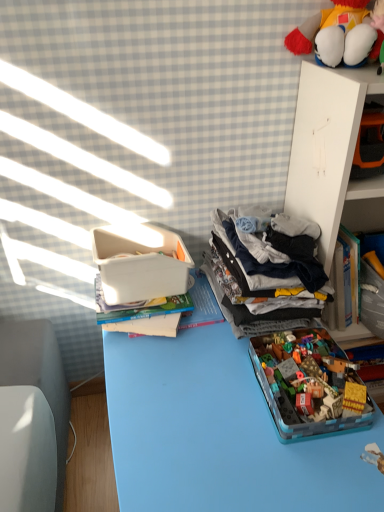
Question: Is dark gray cotton clothes at center right at the back of white plastic container at upper left?

Choices:
 (A) yes
 (B) no

Answer: (B)

Question: Is white plastic container at upper left at the right side of dark gray cotton clothes at center right?

Choices:
 (A) yes
 (B) no

Answer: (B)

Question: Considering the relative sizes of white plastic container at upper left and dark gray cotton clothes at center right in the image provided, is white plastic container at upper left wider than dark gray cotton clothes at center right?

Choices:
 (A) no
 (B) yes

Answer: (B)

Question: Can you confirm if white plastic container at upper left is thinner than dark gray cotton clothes at center right?

Choices:
 (A) yes
 (B) no

Answer: (B)

Question: Considering the relative positions of white plastic container at upper left and dark gray cotton clothes at center right in the image provided, is white plastic container at upper left to the left of dark gray cotton clothes at center right from the viewer's perspective?

Choices:
 (A) no
 (B) yes

Answer: (B)

Question: In the image, is dark gray cotton clothes at center right positioned in front of or behind white cardboard at upper right?

Choices:
 (A) front
 (B) behind

Answer: (B)

Question: Which is correct: dark gray cotton clothes at center right is inside white cardboard at upper right, or outside of it?

Choices:
 (A) inside
 (B) outside

Answer: (B)

Question: From the image's perspective, relative to white cardboard at upper right, is dark gray cotton clothes at center right above or below?

Choices:
 (A) below
 (B) above

Answer: (B)

Question: Is point (301, 313) closer or farther from the camera than point (306, 80)?

Choices:
 (A) closer
 (B) farther

Answer: (B)

Question: In the image, is white cardboard at upper right positioned in front of or behind white plastic container at upper left?

Choices:
 (A) behind
 (B) front

Answer: (B)

Question: From the image's perspective, is white cardboard at upper right above or below white plastic container at upper left?

Choices:
 (A) above
 (B) below

Answer: (B)

Question: Visually, is white cardboard at upper right positioned to the left or to the right of white plastic container at upper left?

Choices:
 (A) right
 (B) left

Answer: (A)

Question: Do you think white cardboard at upper right is within white plastic container at upper left, or outside of it?

Choices:
 (A) outside
 (B) inside

Answer: (A)

Question: Looking at the image, does fluffy plush toy at upper right, which ranks as the second toy in bottom-to-top order, seem bigger or smaller compared to white plastic container at upper left?

Choices:
 (A) small
 (B) big

Answer: (A)

Question: Considering the positions of fluffy plush toy at upper right, which ranks as the second toy in bottom-to-top order, and white plastic container at upper left in the image, is fluffy plush toy at upper right, which ranks as the second toy in bottom-to-top order, wider or thinner than white plastic container at upper left?

Choices:
 (A) thin
 (B) wide

Answer: (A)